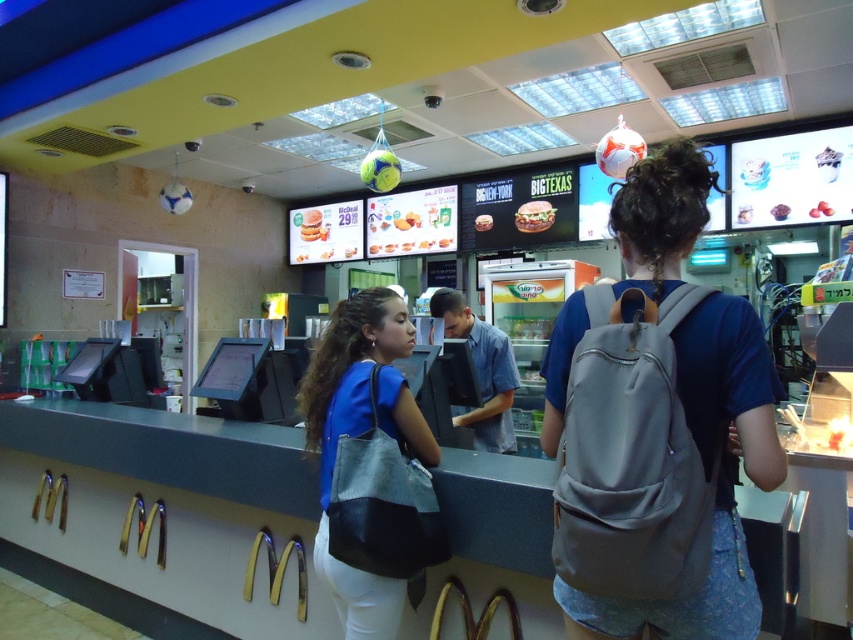
Question: Is gray fabric backpack at center above blue leather bag at center?

Choices:
 (A) no
 (B) yes

Answer: (B)

Question: Does gray fabric backpack at center appear on the right side of blue leather bag at center?

Choices:
 (A) no
 (B) yes

Answer: (B)

Question: Which object is farther from the camera taking this photo?

Choices:
 (A) gray fabric backpack at center
 (B) blue leather bag at center

Answer: (B)

Question: Can you confirm if gray fabric backpack at center is smaller than blue leather bag at center?

Choices:
 (A) no
 (B) yes

Answer: (B)